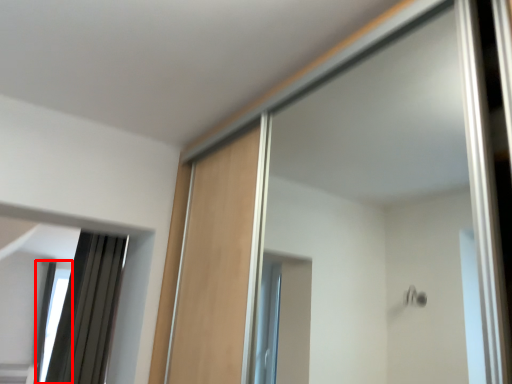
Question: From the image's perspective, where is window (annotated by the red box) located in relation to mirror in the image?

Choices:
 (A) above
 (B) below

Answer: (B)